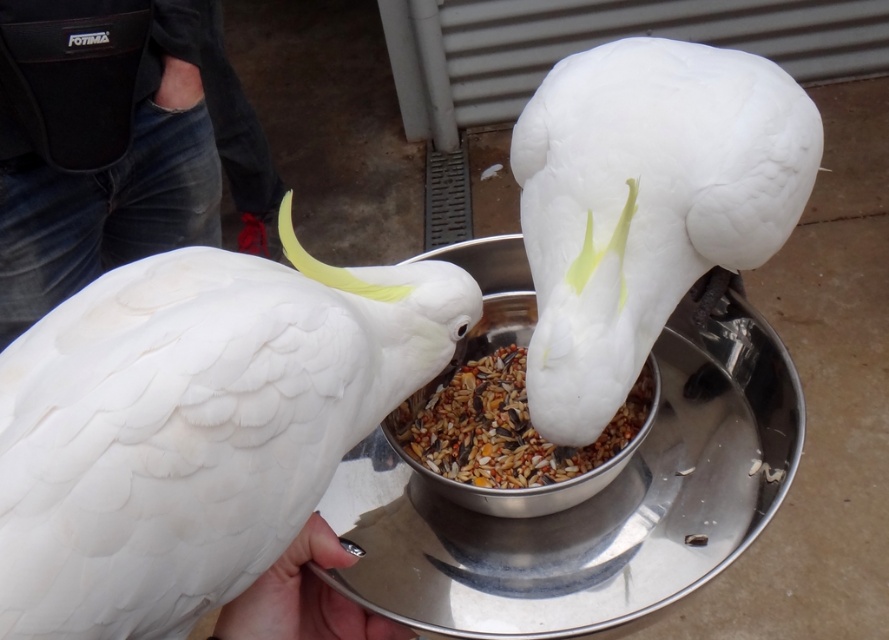
Question: Which object is closer to the camera taking this photo?

Choices:
 (A) white matte parrot at center
 (B) jeans at left
 (C) metallic silver plate at center

Answer: (A)

Question: Is white feathered parrot at center bigger than metallic silver plate at center?

Choices:
 (A) no
 (B) yes

Answer: (A)

Question: Is white feathered parrot at center to the left of white matte parrot at center from the viewer's perspective?

Choices:
 (A) no
 (B) yes

Answer: (B)

Question: Which is nearer to the jeans at left?

Choices:
 (A) white matte hand at lower center
 (B) white matte parrot at center
 (C) metallic silver plate at center
 (D) white feathered parrot at center

Answer: (D)

Question: In this image, where is white matte parrot at center located relative to jeans at left?

Choices:
 (A) right
 (B) left

Answer: (A)

Question: Which object is farther from the camera taking this photo?

Choices:
 (A) jeans at left
 (B) white matte parrot at center

Answer: (A)